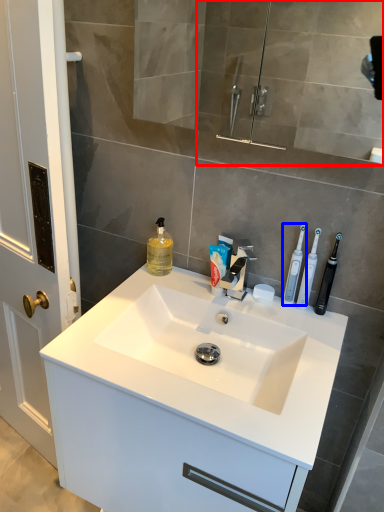
Question: Which object is further to the camera taking this photo, mirror (highlighted by a red box) or toothbrush (highlighted by a blue box)?

Choices:
 (A) mirror
 (B) toothbrush

Answer: (B)